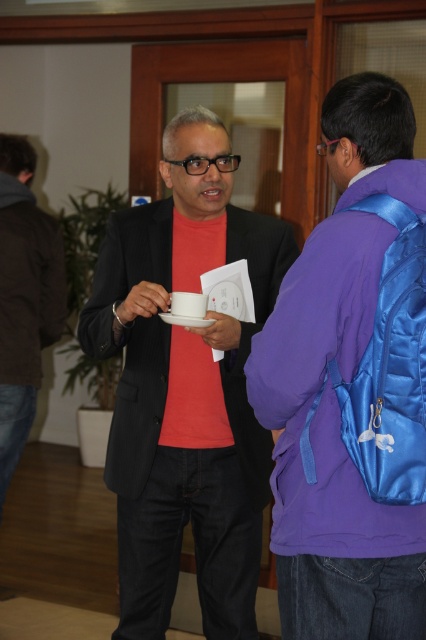
Question: Can you confirm if matte black suit at center is positioned above black matte jacket at left?

Choices:
 (A) no
 (B) yes

Answer: (A)

Question: Can you confirm if matte black jacket at center is thinner than matte black suit at center?

Choices:
 (A) no
 (B) yes

Answer: (B)

Question: Which point is closer to the camera?

Choices:
 (A) black matte jacket at left
 (B) matte black jacket at center
 (C) brown leather jacket at left

Answer: (B)

Question: Is matte black suit at center bigger than black matte jacket at left?

Choices:
 (A) yes
 (B) no

Answer: (A)

Question: Based on their relative distances, which object is farther from the brown leather jacket at left?

Choices:
 (A) matte black jacket at center
 (B) matte black suit at center
 (C) black matte jacket at left

Answer: (A)

Question: Among these points, which one is nearest to the camera?

Choices:
 (A) click(252, 476)
 (B) click(299, 557)
 (C) click(6, 348)
 (D) click(62, 314)

Answer: (B)